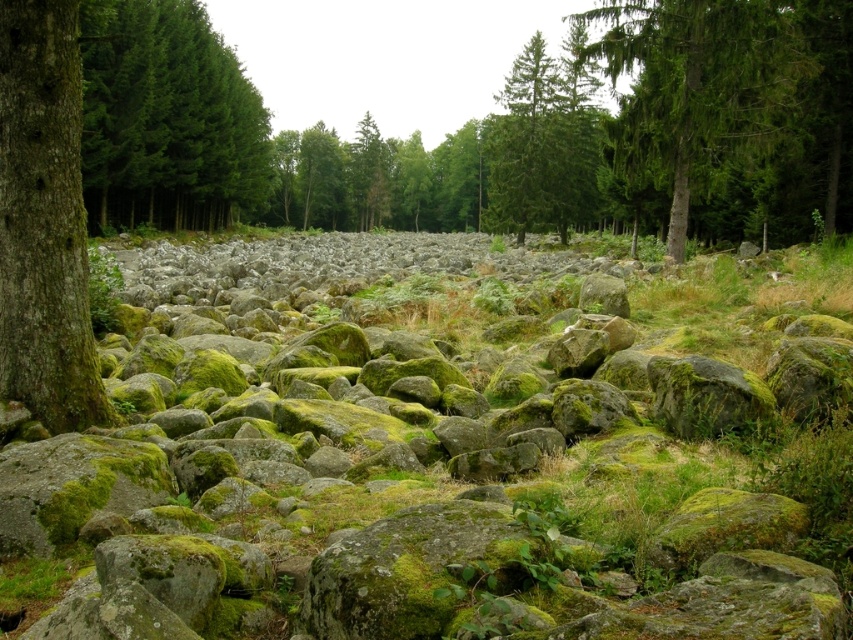
Does green leafy tree at center appear on the left side of green mossy rock at center?

No, green leafy tree at center is not to the left of green mossy rock at center.

The width and height of the screenshot is (853, 640). Describe the element at coordinates (376, 179) in the screenshot. I see `green leafy tree at center` at that location.

This screenshot has height=640, width=853. I want to click on green leafy tree at center, so click(376, 179).

Does green mossy bark tree at left have a smaller size compared to green mossy rock at center?

Yes.

This screenshot has height=640, width=853. What do you see at coordinates (44, 221) in the screenshot?
I see `green mossy bark tree at left` at bounding box center [44, 221].

Image resolution: width=853 pixels, height=640 pixels. In order to click on green mossy bark tree at left in this screenshot , I will do `click(44, 221)`.

Which is above, green mossy rocks at center or green leafy tree at center?

green leafy tree at center is higher up.

Does green mossy rocks at center have a lesser width compared to green leafy tree at center?

Yes.

At what (x,y) coordinates should I click in order to perform the action: click on green mossy rocks at center. Please return your answer as a coordinate pair (x, y). This screenshot has width=853, height=640. Looking at the image, I should click on (422, 461).